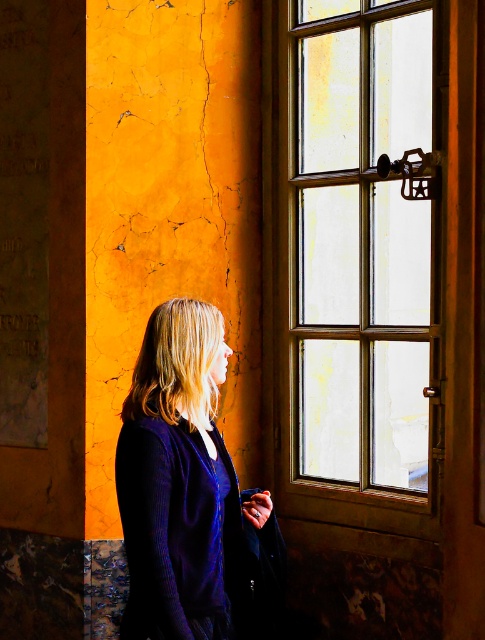
You are standing at the wooden window at right and want to reach the person who is 4.12 meters away. Can you estimate how many steps you would need to take to reach them?

The distance between you and the person is 4.12 meters. Assuming an average step length of about 0.76 meters, you would need approximately 5 to 6 steps to cover the distance.

You are standing in the room and want to open the wooden window at right. Based on its position, where should you move to in order to reach it?

The wooden window at right is located at point 0.405 on the x axis and 0.732 on the y axis, so you should move to the right side of the room and slightly upwards to reach it.